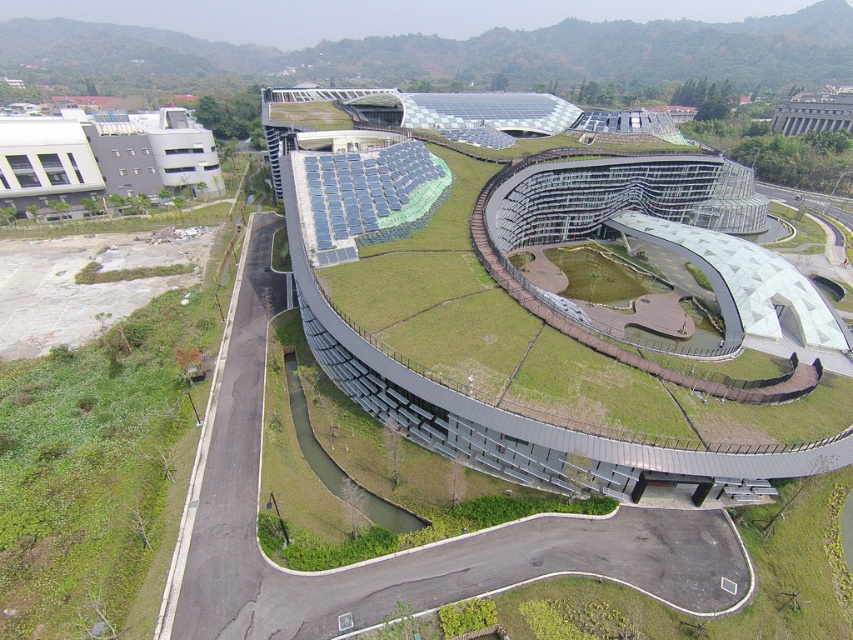
Between white matte building at upper left and metallic gray building at upper right, which one appears on the left side from the viewer's perspective?

From the viewer's perspective, white matte building at upper left appears more on the left side.

The height and width of the screenshot is (640, 853). I want to click on white matte building at upper left, so click(103, 156).

Consider the image. Does green matte building at center appear under metallic gray building at upper right?

Yes, green matte building at center is below metallic gray building at upper right.

At what (x,y) coordinates should I click in order to perform the action: click on green matte building at center. Please return your answer as a coordinate pair (x, y). Looking at the image, I should click on (422, 372).

Based on the photo, is green matte building at center bigger than white matte building at upper left?

Yes, green matte building at center is bigger than white matte building at upper left.

Between green matte building at center and white matte building at upper left, which one has less height?

Standing shorter between the two is white matte building at upper left.

Describe the element at coordinates (422, 372) in the screenshot. This screenshot has height=640, width=853. I see `green matte building at center` at that location.

What are the coordinates of `green matte building at center` in the screenshot? It's located at (422, 372).